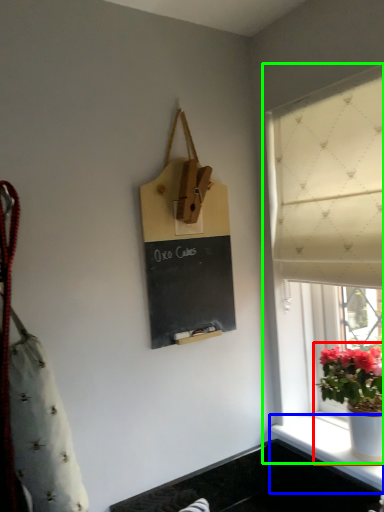
Question: Estimate the real-world distances between objects in this image. Which object is farther from houseplant (highlighted by a red box), window sill (highlighted by a blue box) or window (highlighted by a green box)?

Choices:
 (A) window sill
 (B) window

Answer: (B)